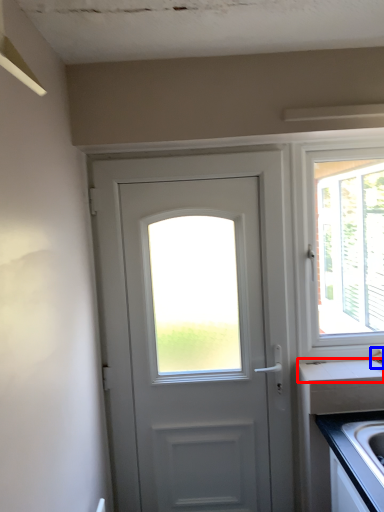
Question: Which object appears farthest to the camera in this image, counter top (highlighted by a red box) or faucet (highlighted by a blue box)?

Choices:
 (A) counter top
 (B) faucet

Answer: (A)